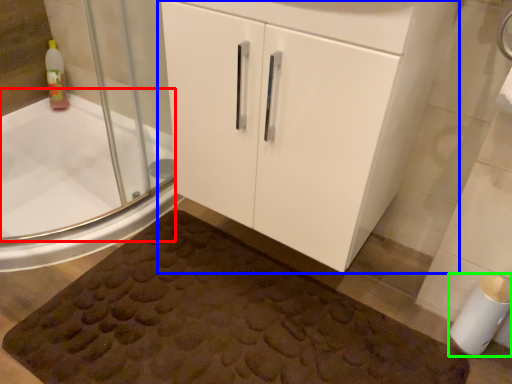
Question: Which object is positioned closest to bath (highlighted by a red box)? Select from bathroom cabinet (highlighted by a blue box) and toilet paper (highlighted by a green box).

Choices:
 (A) bathroom cabinet
 (B) toilet paper

Answer: (A)